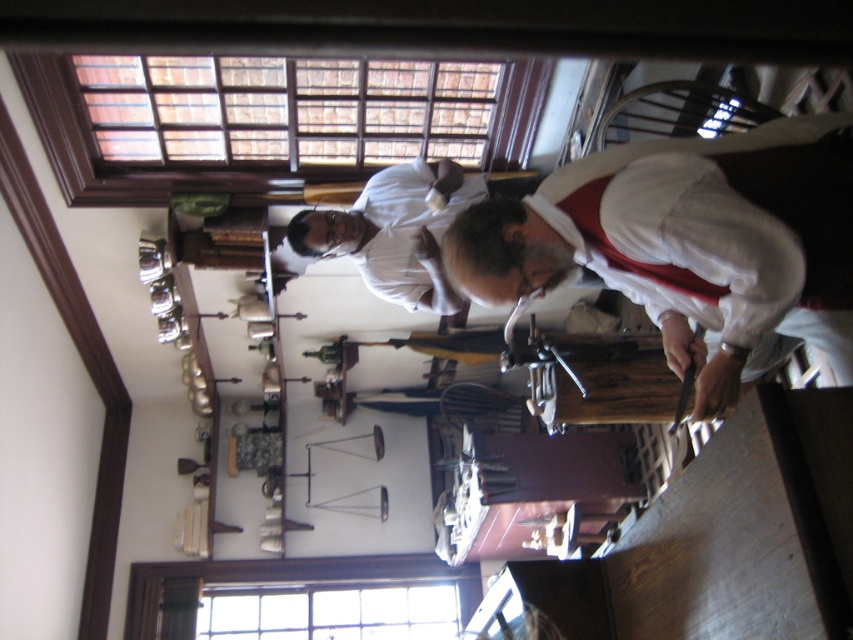
Based on the photo, can you confirm if white matte shirt at center is shorter than white matte shirt at upper center?

Correct, white matte shirt at center is not as tall as white matte shirt at upper center.

Is point (711, 365) positioned after point (428, 280)?

No, it is not.

You are a GUI agent. You are given a task and a screenshot of the screen. Output one action in this format:
    pyautogui.click(x=<x>, y=<y>)
    Task: Click on the white matte shirt at center
    
    Given the screenshot: What is the action you would take?
    pyautogui.click(x=689, y=243)

The height and width of the screenshot is (640, 853). I want to click on white matte shirt at center, so click(x=689, y=243).